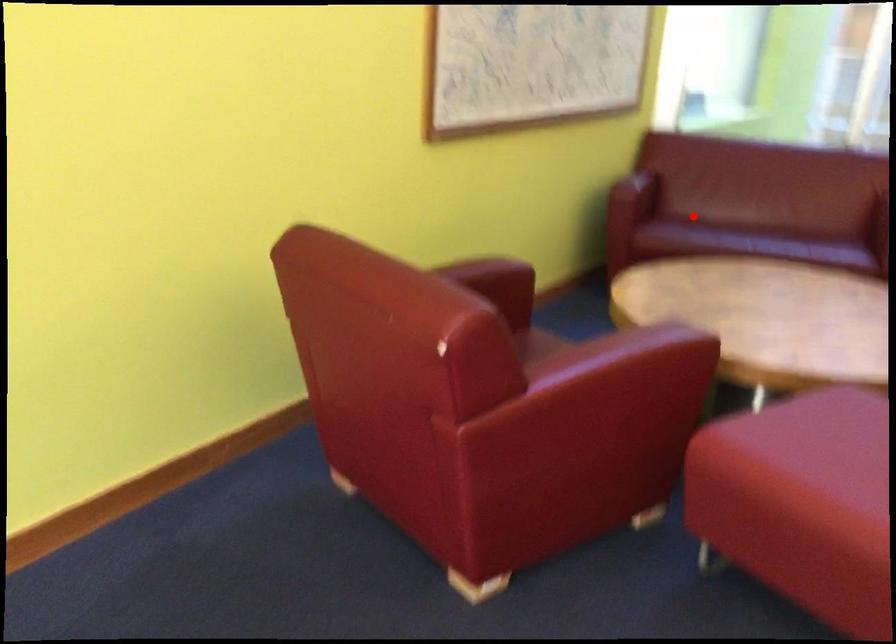
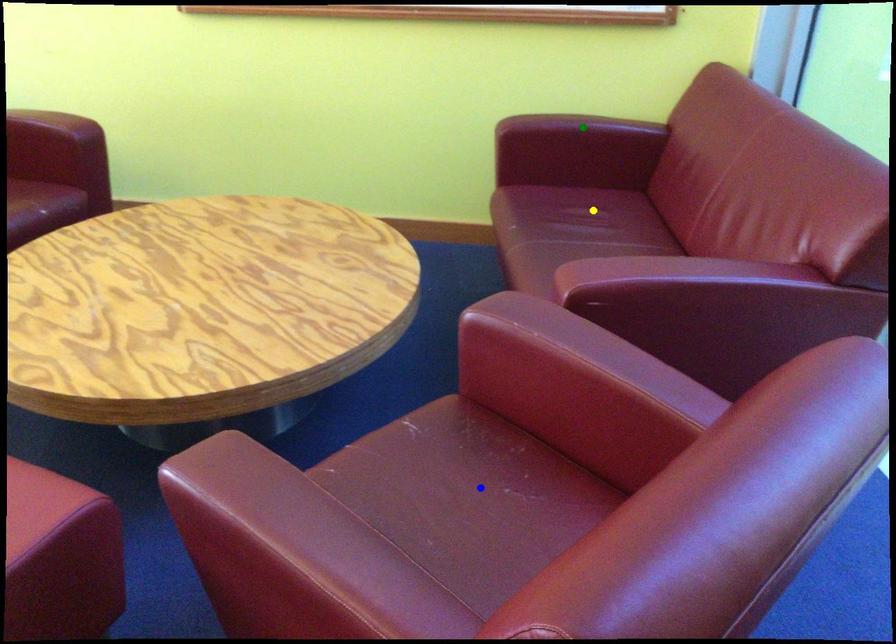
Question: I am providing you with two images of the same scene from different viewpoints. A red point is marked on the first image. You are given multiple points on the second image. Which point in image 2 is actually the same real-world point as the red point in image 1?

Choices:
 (A) blue point
 (B) yellow point
 (C) green point

Answer: (B)